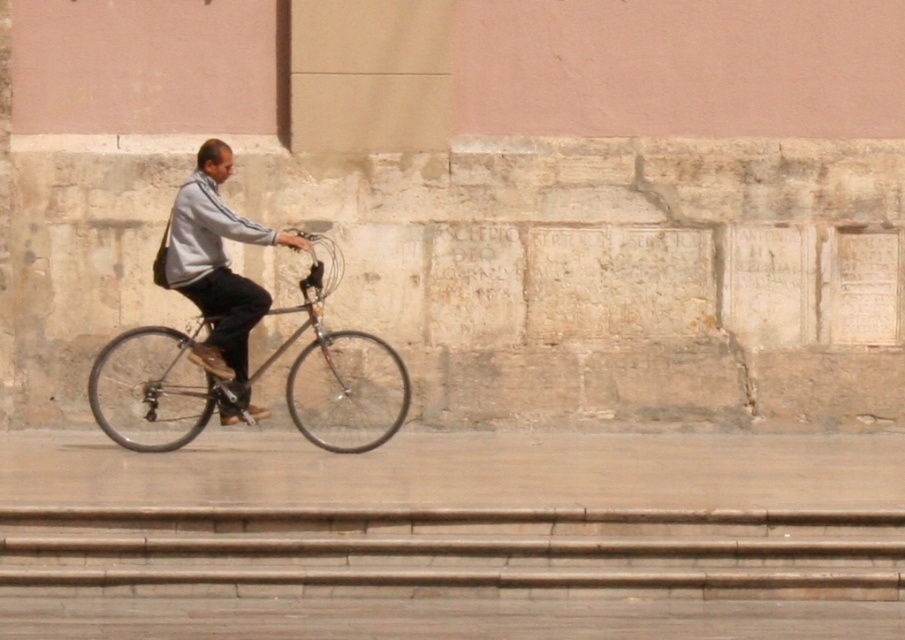
Question: Which object appears farthest from the camera in this image?

Choices:
 (A) shiny black bicycle at center
 (B) light gray fabric jacket at center

Answer: (B)

Question: Can you confirm if shiny black bicycle at center is positioned above light gray fabric jacket at center?

Choices:
 (A) yes
 (B) no

Answer: (B)

Question: Is shiny black bicycle at center positioned behind light gray fabric jacket at center?

Choices:
 (A) yes
 (B) no

Answer: (B)

Question: Can you confirm if shiny black bicycle at center is wider than light gray fabric jacket at center?

Choices:
 (A) yes
 (B) no

Answer: (A)

Question: Among these points, which one is farthest from the camera?

Choices:
 (A) 234,340
 (B) 393,426

Answer: (B)